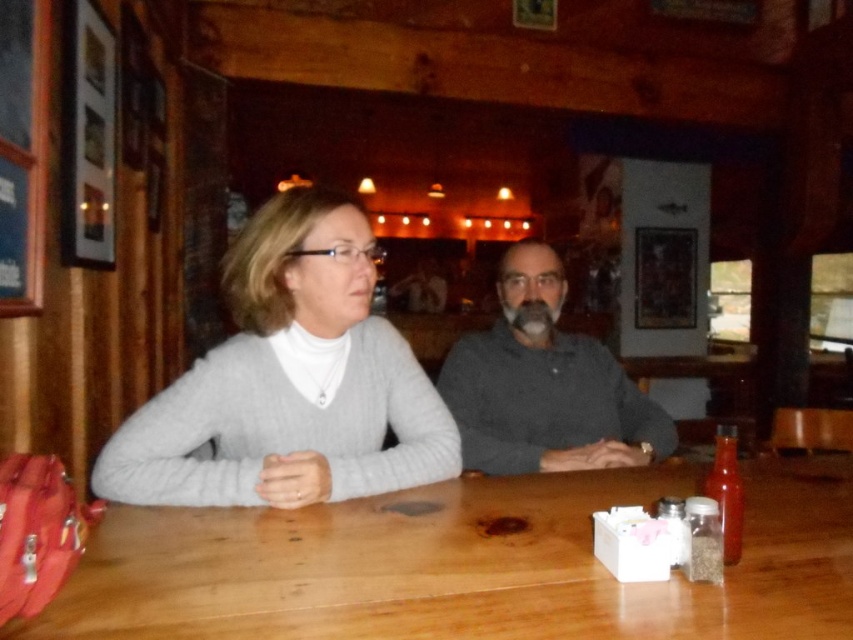
Who is shorter, wooden table at center or gray knitted sweater at center?

wooden table at center

Between point (728, 628) and point (283, 480), which one is positioned behind?

The point (283, 480) is behind.

The height and width of the screenshot is (640, 853). Describe the element at coordinates (461, 564) in the screenshot. I see `wooden table at center` at that location.

Where is `wooden table at center`? This screenshot has height=640, width=853. wooden table at center is located at coordinates (461, 564).

Which of these two, wooden table at center or gray matte sweater at center, stands taller?

Standing taller between the two is gray matte sweater at center.

Identify the location of wooden table at center. The height and width of the screenshot is (640, 853). (461, 564).

The height and width of the screenshot is (640, 853). I want to click on gray knitted sweater at center, so click(x=289, y=381).

Does gray knitted sweater at center appear on the right side of gray matte sweater at center?

Incorrect, gray knitted sweater at center is not on the right side of gray matte sweater at center.

Is point (331, 438) farther from viewer compared to point (477, 433)?

No, it is in front of (477, 433).

Where is `gray knitted sweater at center`? This screenshot has height=640, width=853. gray knitted sweater at center is located at coordinates (289, 381).